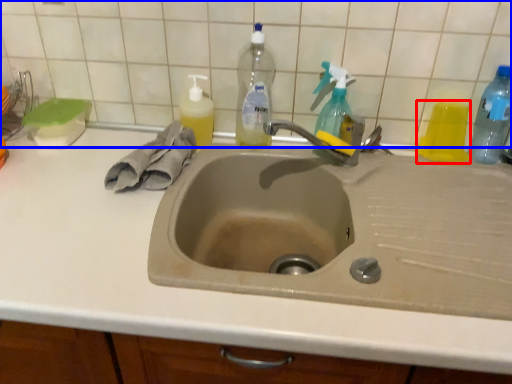
Question: Which of the following is the farthest to the observer, bottle (highlighted by a red box) or tile (highlighted by a blue box)?

Choices:
 (A) bottle
 (B) tile

Answer: (A)